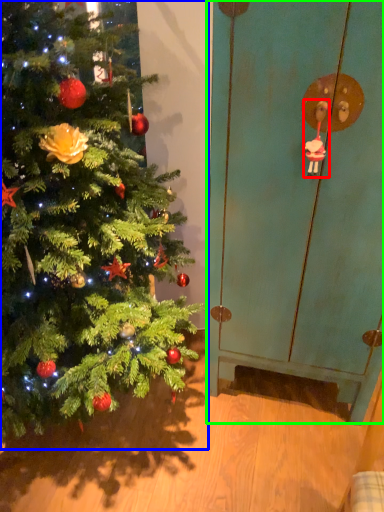
Question: Based on their relative distances, which object is farther from toy (highlighted by a red box)? Choose from christmas tree (highlighted by a blue box) and screen door (highlighted by a green box).

Choices:
 (A) christmas tree
 (B) screen door

Answer: (A)